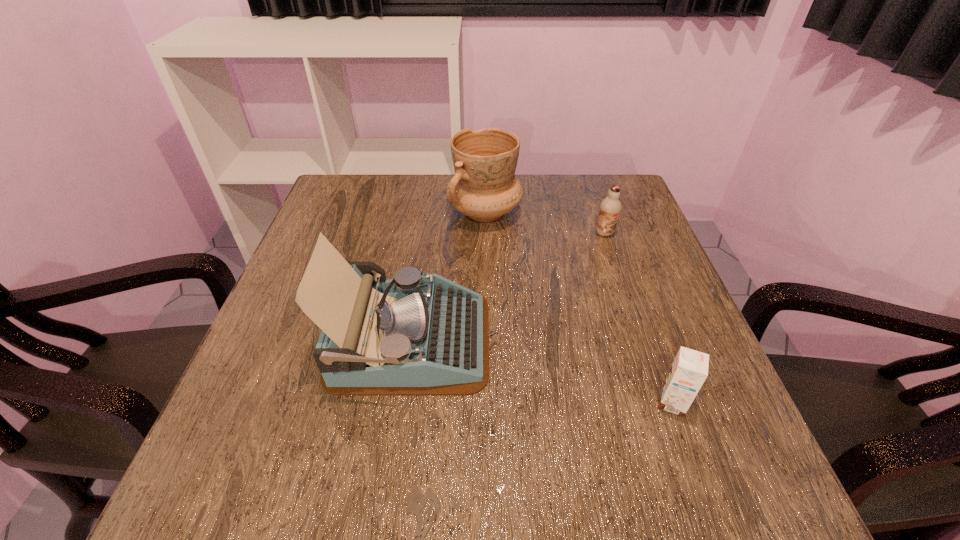
Image resolution: width=960 pixels, height=540 pixels. In order to click on empty location between the pottery and the typewriter in this screenshot , I will do `click(447, 276)`.

The image size is (960, 540). Identify the location of free space between the nearer chocolate milk and the farther chocolate milk. (638, 318).

I want to click on unoccupied position between the typewriter and the nearer chocolate milk, so click(541, 372).

Find the location of a particular element. The height and width of the screenshot is (540, 960). vacant region between the nearer chocolate milk and the pottery is located at coordinates (578, 307).

Where is `vacant area that lies between the nearer chocolate milk and the pottery`? The width and height of the screenshot is (960, 540). vacant area that lies between the nearer chocolate milk and the pottery is located at coordinates (578, 307).

The height and width of the screenshot is (540, 960). Find the location of `vacant space that is in between the pottery and the nearer chocolate milk`. vacant space that is in between the pottery and the nearer chocolate milk is located at coordinates (578, 307).

Locate which object is the second closest to the pottery. Please provide its 2D coordinates. Your answer should be formatted as a tuple, i.e. [(x, y)], where the tuple contains the x and y coordinates of a point satisfying the conditions above.

[(418, 334)]

Locate which object ranks third in proximity to the nearer chocolate milk. Please provide its 2D coordinates. Your answer should be formatted as a tuple, i.e. [(x, y)], where the tuple contains the x and y coordinates of a point satisfying the conditions above.

[(484, 187)]

The image size is (960, 540). I want to click on free spot that satisfies the following two spatial constraints: 1. on the typing side of the typewriter; 2. on the left side of the nearer chocolate milk, so click(x=401, y=403).

Locate an element on the screen. This screenshot has height=540, width=960. vacant space that satisfies the following two spatial constraints: 1. on the front side of the pottery; 2. on the right side of the nearer chocolate milk is located at coordinates (488, 403).